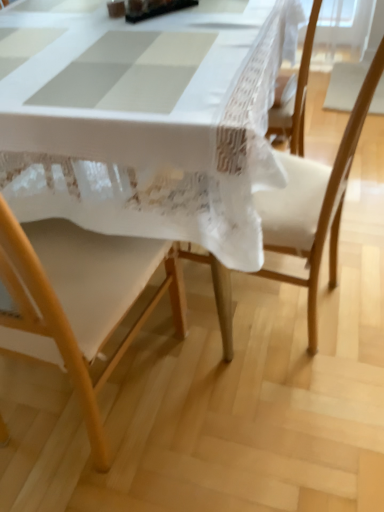
What do you see at coordinates (313, 209) in the screenshot? I see `wooden chair at center, arranged as the first chair when viewed from the right` at bounding box center [313, 209].

What is the approximate height of wooden chair at lower left, acting as the 2th chair starting from the right?

The height of wooden chair at lower left, acting as the 2th chair starting from the right, is 1.02 meters.

Image resolution: width=384 pixels, height=512 pixels. Describe the element at coordinates (79, 298) in the screenshot. I see `wooden chair at lower left, acting as the 2th chair starting from the right` at that location.

Where is `wooden chair at center, arranged as the first chair when viewed from the right`? The width and height of the screenshot is (384, 512). wooden chair at center, arranged as the first chair when viewed from the right is located at coordinates (313, 209).

How many degrees apart are the facing directions of white lace tablecloth at center and wooden chair at center, arranged as the first chair when viewed from the right?

103 degrees.

From the picture: Which of these two, white lace tablecloth at center or wooden chair at center, arranged as the first chair when viewed from the right, is bigger?

With larger size is white lace tablecloth at center.

What are the coordinates of `table behind the wooden chair at center, arranged as the 2th chair when viewed from the left` in the screenshot? It's located at (147, 125).

From the picture: Is white lace tablecloth at center oriented towards wooden chair at lower left, acting as the 2th chair starting from the right?

Yes, white lace tablecloth at center is aimed at wooden chair at lower left, acting as the 2th chair starting from the right.

Is the depth of white lace tablecloth at center greater than that of wooden chair at lower left, the 1th chair in the left-to-right sequence?

That is True.

Is white lace tablecloth at center surrounding wooden chair at lower left, the 1th chair in the left-to-right sequence?

Yes, wooden chair at lower left, the 1th chair in the left-to-right sequence, is inside white lace tablecloth at center.

Which is further, (68, 157) or (172, 282)?

Positioned behind is point (172, 282).

Considering the sizes of wooden chair at lower left, acting as the 2th chair starting from the right, and white lace tablecloth at center in the image, is wooden chair at lower left, acting as the 2th chair starting from the right, taller or shorter than white lace tablecloth at center?

Considering their sizes, wooden chair at lower left, acting as the 2th chair starting from the right, has more height than white lace tablecloth at center.

From the image's perspective, is wooden chair at lower left, acting as the 2th chair starting from the right, on white lace tablecloth at center?

Incorrect, from the image's perspective, wooden chair at lower left, acting as the 2th chair starting from the right, is lower than white lace tablecloth at center.

In the scene shown: Is wooden chair at lower left, acting as the 2th chair starting from the right, thinner than white lace tablecloth at center?

Yes, wooden chair at lower left, acting as the 2th chair starting from the right, is thinner than white lace tablecloth at center.

From the picture: Between wooden chair at lower left, the 1th chair in the left-to-right sequence, and white lace tablecloth at center, which one is positioned in front?

wooden chair at lower left, the 1th chair in the left-to-right sequence, is more forward.

From the image's perspective, is wooden chair at center, arranged as the 2th chair when viewed from the left, above or below white lace tablecloth at center?

From the image's perspective, wooden chair at center, arranged as the 2th chair when viewed from the left, appears below white lace tablecloth at center.

Based on the photo, which is more to the right, wooden chair at center, arranged as the first chair when viewed from the right, or white lace tablecloth at center?

From the viewer's perspective, wooden chair at center, arranged as the first chair when viewed from the right, appears more on the right side.

From a real-world perspective, does wooden chair at center, arranged as the first chair when viewed from the right, stand above white lace tablecloth at center?

Yes, from a real-world perspective, wooden chair at center, arranged as the first chair when viewed from the right, is above white lace tablecloth at center.

Is wooden chair at center, arranged as the first chair when viewed from the right, further to camera compared to white lace tablecloth at center?

No, wooden chair at center, arranged as the first chair when viewed from the right, is closer to the camera.

From the image's perspective, is wooden chair at lower left, acting as the 2th chair starting from the right, above or below wooden chair at center, arranged as the first chair when viewed from the right?

Based on their image positions, wooden chair at lower left, acting as the 2th chair starting from the right, is located beneath wooden chair at center, arranged as the first chair when viewed from the right.

Is wooden chair at lower left, acting as the 2th chair starting from the right, oriented away from wooden chair at center, arranged as the 2th chair when viewed from the left?

No, wooden chair at lower left, acting as the 2th chair starting from the right, is not facing away from wooden chair at center, arranged as the 2th chair when viewed from the left.

From a real-world perspective, is wooden chair at lower left, the 1th chair in the left-to-right sequence, physically above wooden chair at center, arranged as the 2th chair when viewed from the left?

Correct, in the physical world, wooden chair at lower left, the 1th chair in the left-to-right sequence, is higher than wooden chair at center, arranged as the 2th chair when viewed from the left.

How different are the orientations of wooden chair at lower left, the 1th chair in the left-to-right sequence, and wooden chair at center, arranged as the first chair when viewed from the right, in degrees?

81.5 degrees separate the facing orientations of wooden chair at lower left, the 1th chair in the left-to-right sequence, and wooden chair at center, arranged as the first chair when viewed from the right.

From the image's perspective, is wooden chair at center, arranged as the 2th chair when viewed from the left, beneath wooden chair at lower left, the 1th chair in the left-to-right sequence?

No, from the image's perspective, wooden chair at center, arranged as the 2th chair when viewed from the left, is not below wooden chair at lower left, the 1th chair in the left-to-right sequence.

Is wooden chair at center, arranged as the 2th chair when viewed from the left, oriented away from wooden chair at lower left, the 1th chair in the left-to-right sequence?

wooden chair at center, arranged as the 2th chair when viewed from the left, does not have its back to wooden chair at lower left, the 1th chair in the left-to-right sequence.

Is wooden chair at center, arranged as the 2th chair when viewed from the left, far from wooden chair at lower left, acting as the 2th chair starting from the right?

No, there isn't a large distance between wooden chair at center, arranged as the 2th chair when viewed from the left, and wooden chair at lower left, acting as the 2th chair starting from the right.

I want to click on the 1st chair in front of the white lace tablecloth at center, so click(313, 209).

Image resolution: width=384 pixels, height=512 pixels. What are the coordinates of `table above the wooden chair at lower left, the 1th chair in the left-to-right sequence (from the image's perspective)` in the screenshot? It's located at (147, 125).

Considering their positions, is wooden chair at lower left, acting as the 2th chair starting from the right, positioned further to wooden chair at center, arranged as the 2th chair when viewed from the left, than white lace tablecloth at center?

Among the two, white lace tablecloth at center is located further to wooden chair at center, arranged as the 2th chair when viewed from the left.

Looking at the image, which one is located closer to wooden chair at center, arranged as the first chair when viewed from the right, white lace tablecloth at center or wooden chair at lower left, acting as the 2th chair starting from the right?

wooden chair at lower left, acting as the 2th chair starting from the right, is closer to wooden chair at center, arranged as the first chair when viewed from the right.

When comparing their distances from wooden chair at lower left, acting as the 2th chair starting from the right, does wooden chair at center, arranged as the 2th chair when viewed from the left, or white lace tablecloth at center seem further?

Based on the image, wooden chair at center, arranged as the 2th chair when viewed from the left, appears to be further to wooden chair at lower left, acting as the 2th chair starting from the right.

Estimate the real-world distances between objects in this image. Which object is further from white lace tablecloth at center, wooden chair at center, arranged as the first chair when viewed from the right, or wooden chair at lower left, the 1th chair in the left-to-right sequence?

Among the two, wooden chair at center, arranged as the first chair when viewed from the right, is located further to white lace tablecloth at center.

From the image, which object appears to be nearer to white lace tablecloth at center, wooden chair at lower left, the 1th chair in the left-to-right sequence, or wooden chair at center, arranged as the 2th chair when viewed from the left?

Among the two, wooden chair at lower left, the 1th chair in the left-to-right sequence, is located nearer to white lace tablecloth at center.

From the image, which object appears to be farther from wooden chair at lower left, the 1th chair in the left-to-right sequence, white lace tablecloth at center or wooden chair at center, arranged as the 2th chair when viewed from the left?

wooden chair at center, arranged as the 2th chair when viewed from the left.

Locate an element on the screen. The height and width of the screenshot is (512, 384). table between wooden chair at lower left, the 1th chair in the left-to-right sequence, and wooden chair at center, arranged as the 2th chair when viewed from the left, from left to right is located at coordinates (147, 125).